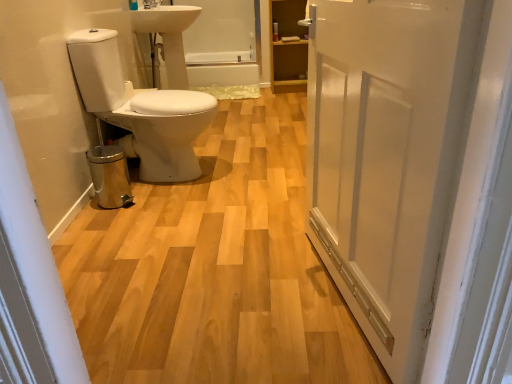
At what (x,y) coordinates should I click in order to perform the action: click on free point to the right of white glossy toilet at left. Please return your answer as a coordinate pair (x, y). Looking at the image, I should click on (257, 165).